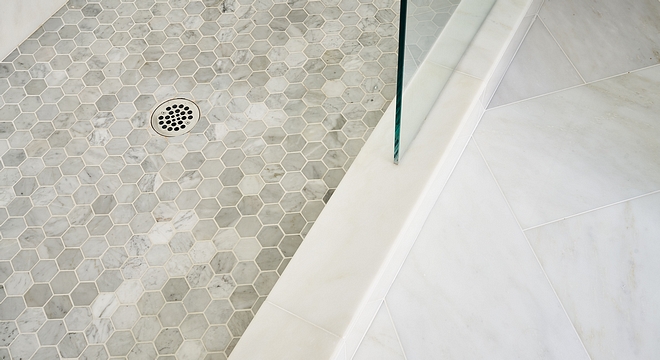
The height and width of the screenshot is (360, 660). Find the location of `top of shower curb`. top of shower curb is located at coordinates (346, 219).